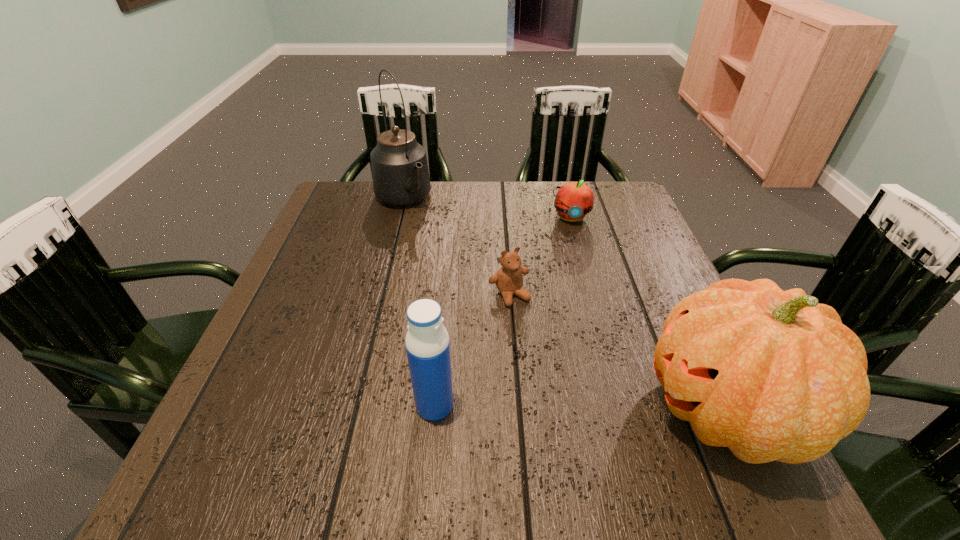
Where is `vacant region located 0.210m on the carved face of the fourth shortest object`? Image resolution: width=960 pixels, height=540 pixels. vacant region located 0.210m on the carved face of the fourth shortest object is located at coordinates click(524, 409).

Where is `vacant space positioned on the carved face of the fourth shortest object`? vacant space positioned on the carved face of the fourth shortest object is located at coordinates (570, 409).

This screenshot has width=960, height=540. I want to click on free space located 0.400m on the surface of the apple, so click(x=583, y=341).

Find the location of `blank area located 0.330m on the surface of the apple`. blank area located 0.330m on the surface of the apple is located at coordinates (580, 316).

Where is `blank space located on the surface of the apple`? Image resolution: width=960 pixels, height=540 pixels. blank space located on the surface of the apple is located at coordinates (579, 309).

You are a GUI agent. You are given a task and a screenshot of the screen. Output one action in this format:
    pyautogui.click(x=<x>, y=<y>)
    Task: Click on the free spot located 0.170m on the face of the teddy bear
    Image resolution: width=960 pixels, height=540 pixels.
    Given the screenshot: What is the action you would take?
    pyautogui.click(x=559, y=367)

Find the location of a particular element. vacant space located on the face of the teddy bear is located at coordinates (562, 370).

Where is `vacant space situated 0.250m on the face of the teddy bear`? vacant space situated 0.250m on the face of the teddy bear is located at coordinates (582, 400).

Locate an element on the screen. free point located 0.220m spout on the leftmost object is located at coordinates (451, 260).

Identify the location of free space located spout on the leftmost object. Image resolution: width=960 pixels, height=540 pixels. (468, 278).